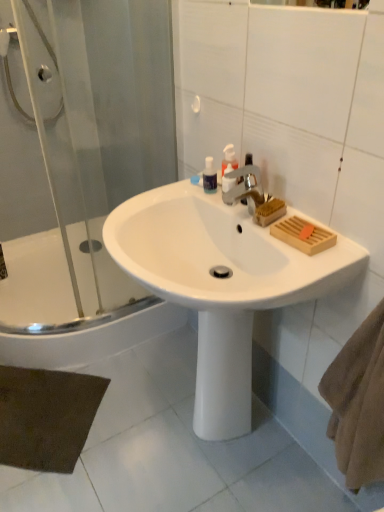
This screenshot has width=384, height=512. What do you see at coordinates (209, 176) in the screenshot?
I see `transparent plastic mouthwash at upper center` at bounding box center [209, 176].

Describe the element at coordinates (46, 417) in the screenshot. The image size is (384, 512). I see `brown felt bath mat at lower left` at that location.

This screenshot has height=512, width=384. I want to click on white glossy bathtub at lower left, so pyautogui.click(x=66, y=307).

Does brown felt bath mat at lower left turn towards white glossy bathtub at lower left?

No, brown felt bath mat at lower left is not turned towards white glossy bathtub at lower left.

Looking at the image, does brown felt bath mat at lower left seem bigger or smaller compared to white glossy bathtub at lower left?

Clearly, brown felt bath mat at lower left is smaller in size than white glossy bathtub at lower left.

Is brown felt bath mat at lower left completely or partially outside of white glossy bathtub at lower left?

Yes.

From the image's perspective, between brown felt bath mat at lower left and white glossy bathtub at lower left, which one is located above?

From the image's view, white glossy bathtub at lower left is above.

From the image's perspective, which is below, silver metallic faucet at center or brown felt bath mat at lower left?

brown felt bath mat at lower left, from the image's perspective.

What's the angular difference between silver metallic faucet at center and brown felt bath mat at lower left's facing directions?

44.6 degrees separate the facing orientations of silver metallic faucet at center and brown felt bath mat at lower left.

Considering the positions of objects silver metallic faucet at center and brown felt bath mat at lower left in the image provided, who is more to the left, silver metallic faucet at center or brown felt bath mat at lower left?

Positioned to the left is brown felt bath mat at lower left.

Between silver metallic faucet at center and brown felt bath mat at lower left, which one is positioned in front?

silver metallic faucet at center is in front.

Considering the relative positions of brown felt bath mat at lower left and silver metallic faucet at center in the image provided, is brown felt bath mat at lower left to the left of silver metallic faucet at center from the viewer's perspective?

Indeed, brown felt bath mat at lower left is positioned on the left side of silver metallic faucet at center.

Between point (38, 376) and point (251, 180), which one is positioned in front?

The point (251, 180) is closer.

Is brown felt bath mat at lower left facing away from silver metallic faucet at center?

No, brown felt bath mat at lower left is not facing away from silver metallic faucet at center.

Does brown felt bath mat at lower left have a greater width compared to silver metallic faucet at center?

Correct, the width of brown felt bath mat at lower left exceeds that of silver metallic faucet at center.

Is the depth of transparent plastic mouthwash at upper center greater than that of brown felt bath mat at lower left?

No, it is in front of brown felt bath mat at lower left.

Which of these two, transparent plastic mouthwash at upper center or brown felt bath mat at lower left, stands taller?

transparent plastic mouthwash at upper center.

In order to click on bath mat below the transparent plastic mouthwash at upper center (from a real-world perspective) in this screenshot , I will do `click(46, 417)`.

Consider the image. Can we say transparent plastic mouthwash at upper center lies outside brown felt bath mat at lower left?

transparent plastic mouthwash at upper center is positioned outside brown felt bath mat at lower left.

Considering the sizes of white glossy bathtub at lower left and translucent plastic soap dispenser at upper center in the image, is white glossy bathtub at lower left bigger or smaller than translucent plastic soap dispenser at upper center?

Clearly, white glossy bathtub at lower left is larger in size than translucent plastic soap dispenser at upper center.

From a real-world perspective, is white glossy bathtub at lower left on top of translucent plastic soap dispenser at upper center?

Incorrect, from a real-world perspective, white glossy bathtub at lower left is lower than translucent plastic soap dispenser at upper center.

You are a GUI agent. You are given a task and a screenshot of the screen. Output one action in this format:
    pyautogui.click(x=<x>, y=<y>)
    Task: Click on the soap dispenser above the white glossy bathtub at lower left (from a real-world perspective)
    
    Given the screenshot: What is the action you would take?
    pyautogui.click(x=229, y=158)

Is white glossy bathtub at lower left placed right next to translucent plastic soap dispenser at upper center?

No.

Is white glossy sink at center taller or shorter than brown felt bath mat at lower left?

In the image, white glossy sink at center appears to be taller than brown felt bath mat at lower left.

Between white glossy sink at center and brown felt bath mat at lower left, which one appears on the left side from the viewer's perspective?

Positioned to the left is brown felt bath mat at lower left.

Where is `sink located above the brown felt bath mat at lower left (from the image's perspective)`? This screenshot has width=384, height=512. sink located above the brown felt bath mat at lower left (from the image's perspective) is located at coordinates tap(220, 284).

Is translucent plastic soap dispenser at upper center taller or shorter than white glossy sink at center?

Considering their sizes, translucent plastic soap dispenser at upper center has less height than white glossy sink at center.

Is translucent plastic soap dispenser at upper center inside or outside of white glossy sink at center?

translucent plastic soap dispenser at upper center is outside white glossy sink at center.

Looking at the image, does translucent plastic soap dispenser at upper center seem bigger or smaller compared to white glossy sink at center?

translucent plastic soap dispenser at upper center is smaller than white glossy sink at center.

In the scene shown: How distant is translucent plastic soap dispenser at upper center from white glossy sink at center?

16.82 inches.

The width and height of the screenshot is (384, 512). Find the location of `bath mat below the white glossy bathtub at lower left (from the image's perspective)`. bath mat below the white glossy bathtub at lower left (from the image's perspective) is located at coordinates (46, 417).

Where is `bath mat below the silver metallic faucet at center (from a real-world perspective)`? Image resolution: width=384 pixels, height=512 pixels. bath mat below the silver metallic faucet at center (from a real-world perspective) is located at coordinates (46, 417).

Based on their spatial positions, is translucent plastic soap dispenser at upper center or white glossy bathtub at lower left closer to silver metallic faucet at center?

translucent plastic soap dispenser at upper center is closer to silver metallic faucet at center.

Estimate the real-world distances between objects in this image. Which object is further from silver metallic faucet at center, white glossy bathtub at lower left or white glossy sink at center?

Among the two, white glossy bathtub at lower left is located further to silver metallic faucet at center.

Considering their positions, is transparent glass shower door at left positioned closer to translucent plastic soap dispenser at upper center than brown felt bath mat at lower left?

transparent glass shower door at left is closer to translucent plastic soap dispenser at upper center.

Which object lies nearer to the anchor point white glossy bathtub at lower left, brown felt bath mat at lower left or white glossy sink at center?

The object closer to white glossy bathtub at lower left is brown felt bath mat at lower left.

Based on their spatial positions, is silver metallic faucet at center or translucent plastic soap dispenser at upper center further from brown felt bath mat at lower left?

translucent plastic soap dispenser at upper center lies further to brown felt bath mat at lower left than the other object.

From the image, which object appears to be farther from silver metallic faucet at center, white glossy bathtub at lower left or translucent plastic soap dispenser at upper center?

white glossy bathtub at lower left is further to silver metallic faucet at center.

Based on their spatial positions, is transparent plastic mouthwash at upper center or white glossy bathtub at lower left further from translucent plastic soap dispenser at upper center?

white glossy bathtub at lower left.

From the image, which object appears to be nearer to transparent plastic mouthwash at upper center, silver metallic faucet at center or brown felt bath mat at lower left?

silver metallic faucet at center lies closer to transparent plastic mouthwash at upper center than the other object.

Locate an element on the screen. bath mat between white glossy sink at center and white glossy bathtub at lower left in the front-back direction is located at coordinates (46, 417).

Identify the location of tap between transparent glass shower door at left and brown felt bath mat at lower left vertically. (245, 187).

Locate an element on the screen. mouthwash between transparent glass shower door at left and translucent plastic soap dispenser at upper center from left to right is located at coordinates (209, 176).

Where is `mouthwash that lies between translucent plastic soap dispenser at upper center and brown felt bath mat at lower left from top to bottom`? This screenshot has width=384, height=512. mouthwash that lies between translucent plastic soap dispenser at upper center and brown felt bath mat at lower left from top to bottom is located at coordinates (209, 176).